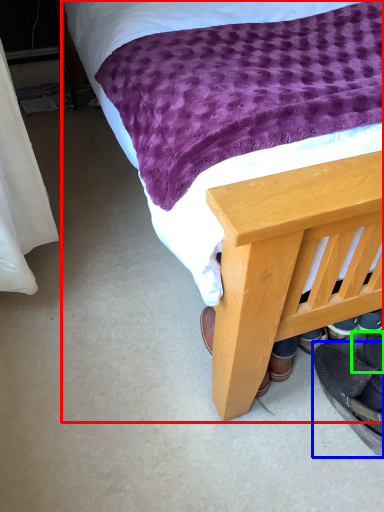
Question: Considering the real-world distances, which object is farthest from bed (highlighted by a red box)? footwear (highlighted by a blue box) or footwear (highlighted by a green box)?

Choices:
 (A) footwear
 (B) footwear

Answer: (B)